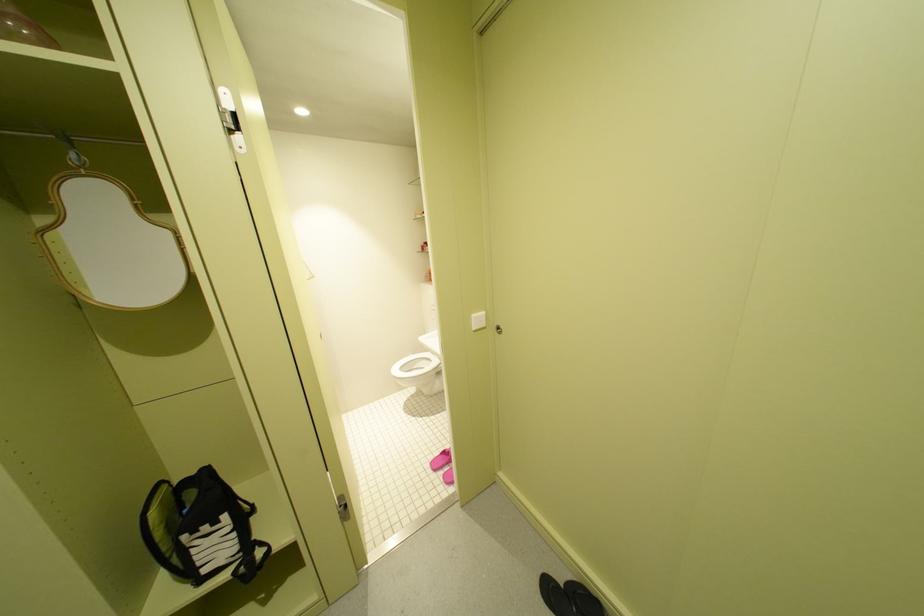
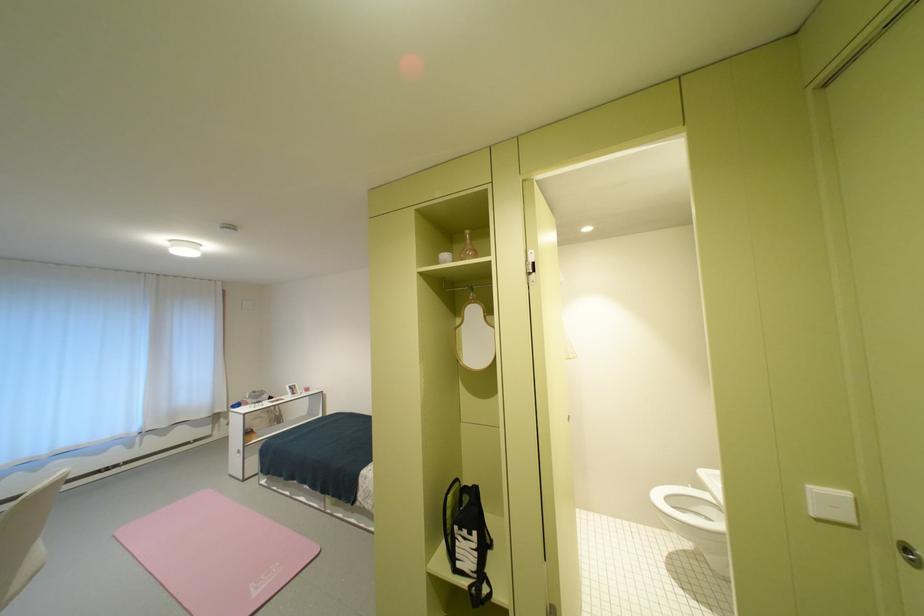
Where in the second image is the point corresponding to pixel 482 317 from the first image?

(821, 488)